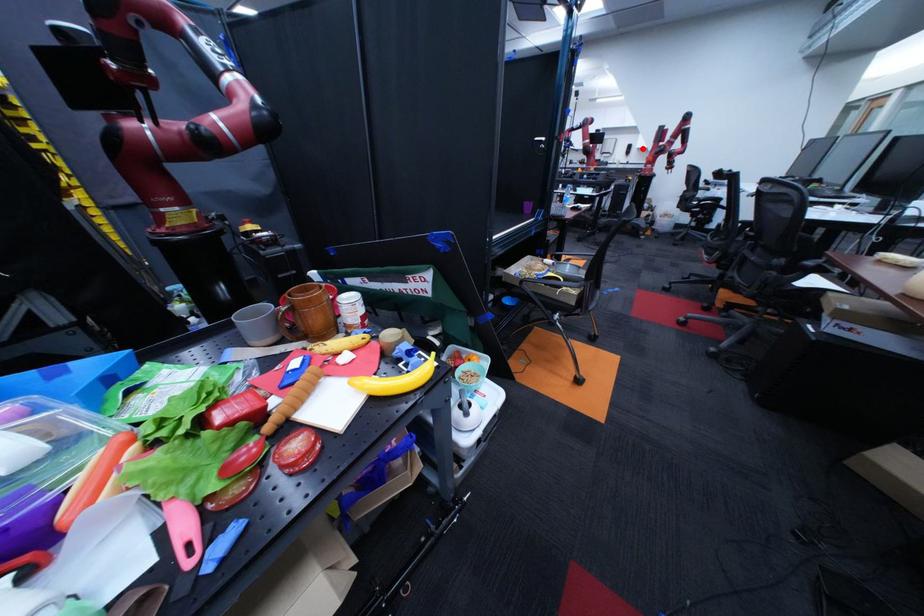
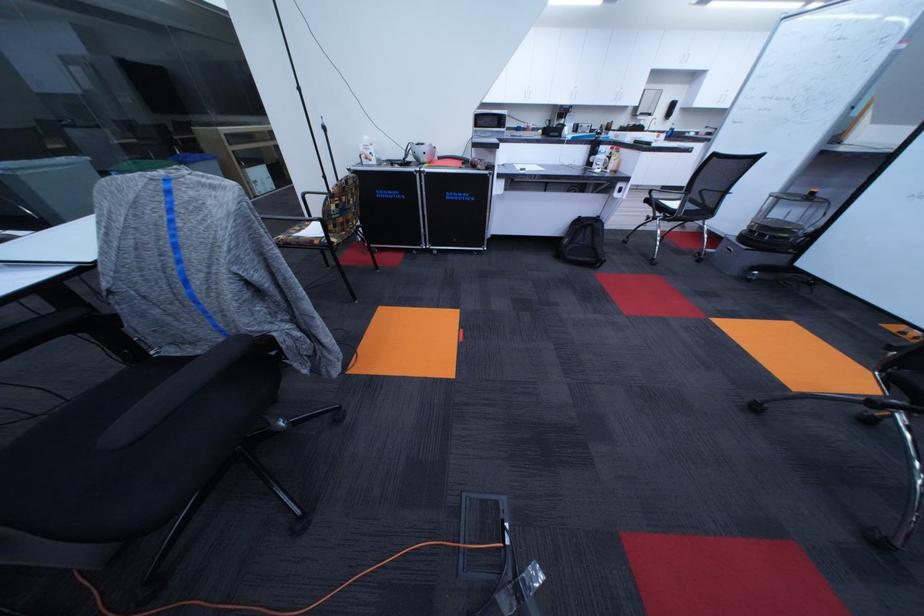
Question: I am providing you with two images of the same scene from different viewpoints. Image1 has a red point marked. In image2, the corresponding 3D location appears at what relative position? Reply with the corresponding letter.

Choices:
 (A) Closer
 (B) Farther

Answer: (B)